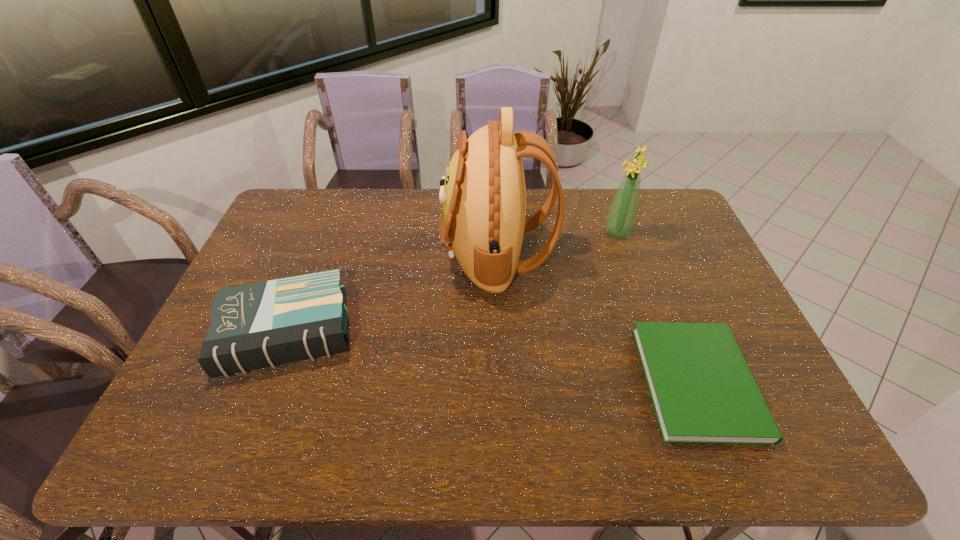
The image size is (960, 540). In order to click on vacant space that's between the backpack and the second tallest object in this screenshot , I will do `click(557, 243)`.

This screenshot has width=960, height=540. Identify the location of empty space that is in between the bouquet and the right paperback book. (658, 307).

Locate an element on the screen. The width and height of the screenshot is (960, 540). free space between the second tallest object and the shortest object is located at coordinates (658, 307).

At what (x,y) coordinates should I click in order to perform the action: click on free spot between the backpack and the left paperback book. Please return your answer as a coordinate pair (x, y). This screenshot has height=540, width=960. Looking at the image, I should click on (393, 293).

Identify the location of vacant space in between the bouquet and the backpack. (557, 243).

You are a GUI agent. You are given a task and a screenshot of the screen. Output one action in this format:
    pyautogui.click(x=<x>, y=<y>)
    Task: Click on the vacant point located between the bouquet and the shortest object
    The height and width of the screenshot is (540, 960).
    Given the screenshot: What is the action you would take?
    pos(658,307)

Identify which object is the nearest to the second shortest object. Please provide its 2D coordinates. Your answer should be formatted as a tuple, i.e. [(x, y)], where the tuple contains the x and y coordinates of a point satisfying the conditions above.

[(483, 196)]

Locate an element on the screen. the third closest object relative to the third shortest object is located at coordinates (265, 324).

Find the location of a particular element. blank area in the image that satisfies the following two spatial constraints: 1. on the front-facing side of the right paperback book; 2. on the right side of the second object from left to right is located at coordinates (502, 382).

Image resolution: width=960 pixels, height=540 pixels. In order to click on free region that satisfies the following two spatial constraints: 1. on the front-facing side of the second tallest object; 2. on the front side of the leftmost object in this screenshot , I will do `click(652, 332)`.